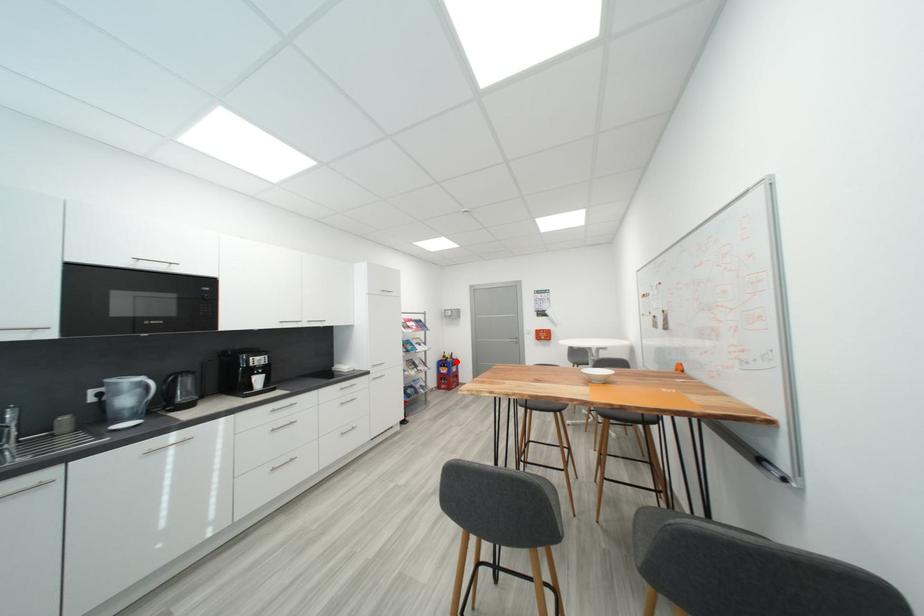
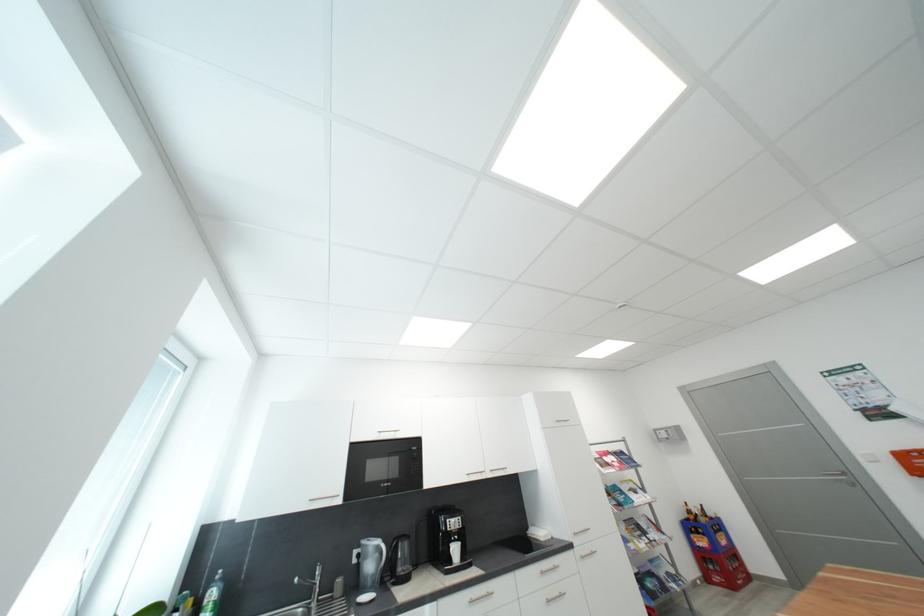
Question: I am providing you with two images of the same scene from different viewpoints. Given a red point in image1, look at the same physical point in image2. Is it:

Choices:
 (A) Closer to the viewpoint
 (B) Farther from the viewpoint

Answer: (A)